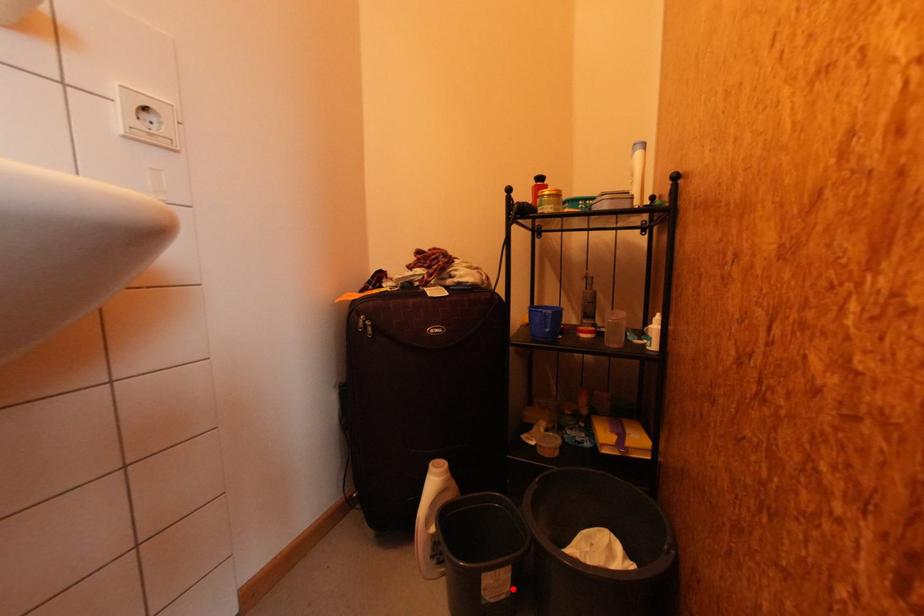
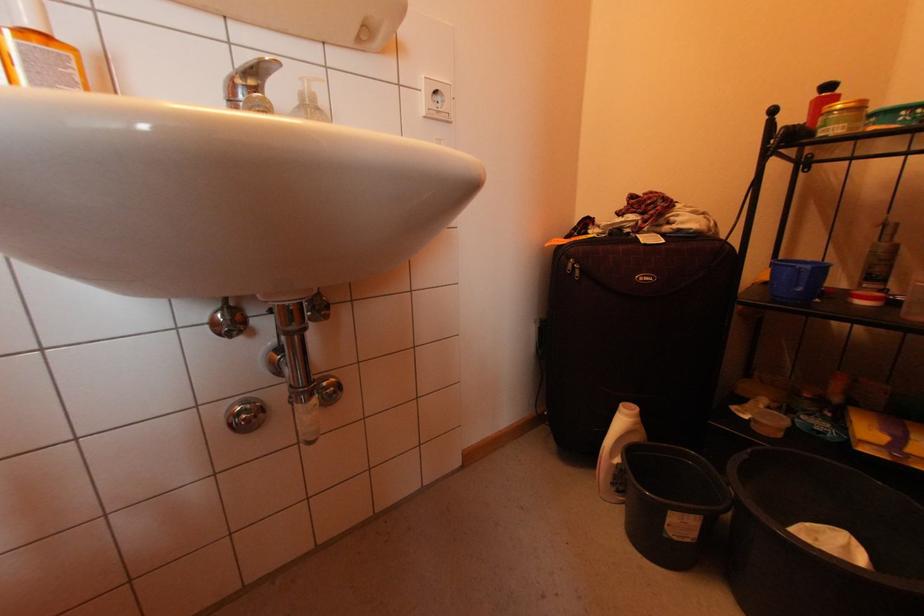
Question: A red point is marked in image1. In image2, is the corresponding 3D point closer to the camera or farther? Reply with the corresponding letter.

Choices:
 (A) The corresponding 3D point is closer.
 (B) The corresponding 3D point is farther.

Answer: (A)